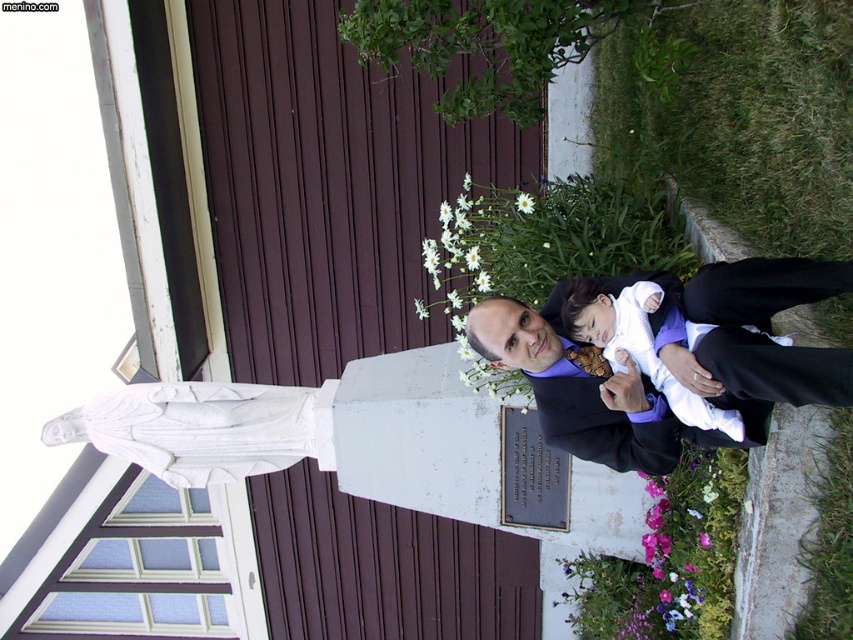
You need to determine if the black satin suit at right can fit into a space that is the same width as the white fabric baby at center. Based on the scene description, can it fit?

The black satin suit at right is wider than the white fabric baby at center, so it cannot fit into a space with the same width as the white fabric baby at center.